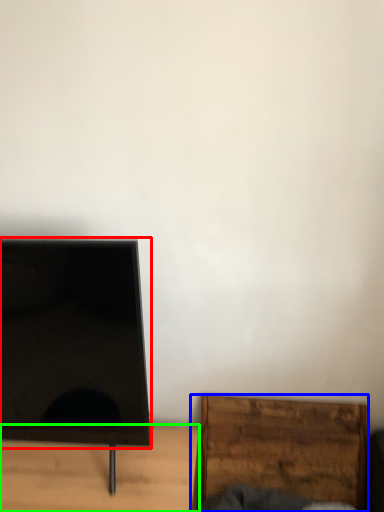
Question: Estimate the real-world distances between objects in this image. Which object is closer to screen (highlighted by a red box), furniture (highlighted by a blue box) or furniture (highlighted by a green box)?

Choices:
 (A) furniture
 (B) furniture

Answer: (B)